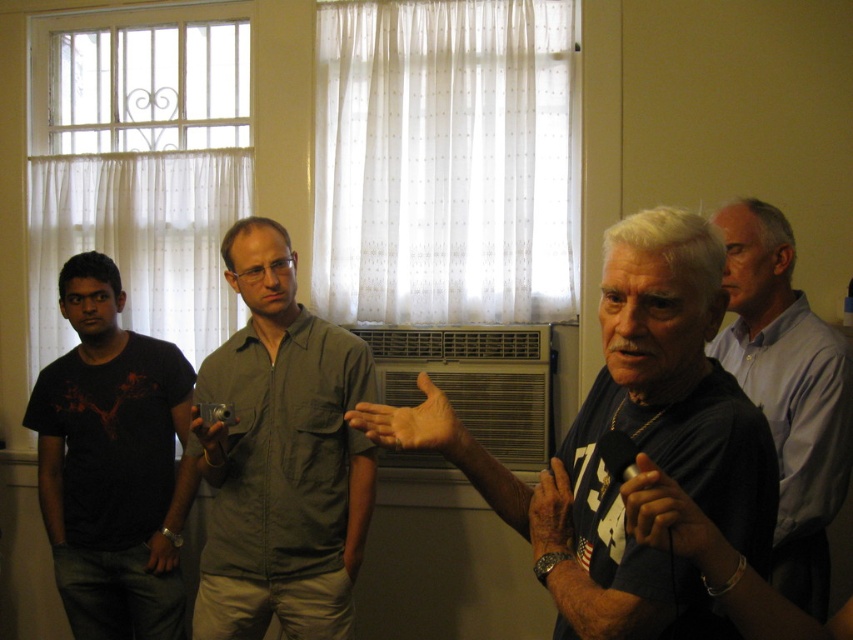
You are a photographer trying to capture a candid shot of the light blue shirt at right and the matte black hand at center. To ensure both are in frame, should you adjust your camera to the left or right?

Since the light blue shirt at right is to the right of the matte black hand at center, you should adjust your camera to the right to include both in the frame.